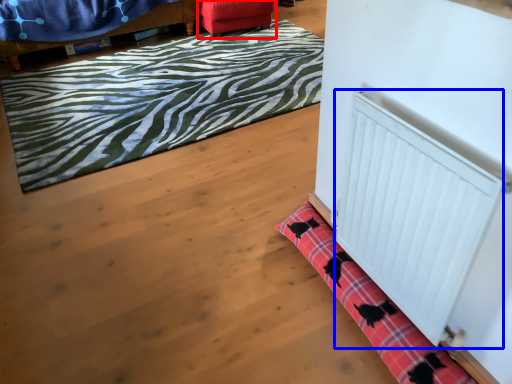
Question: Which point is further to the camera, furniture (highlighted by a red box) or radiator (highlighted by a blue box)?

Choices:
 (A) furniture
 (B) radiator

Answer: (A)